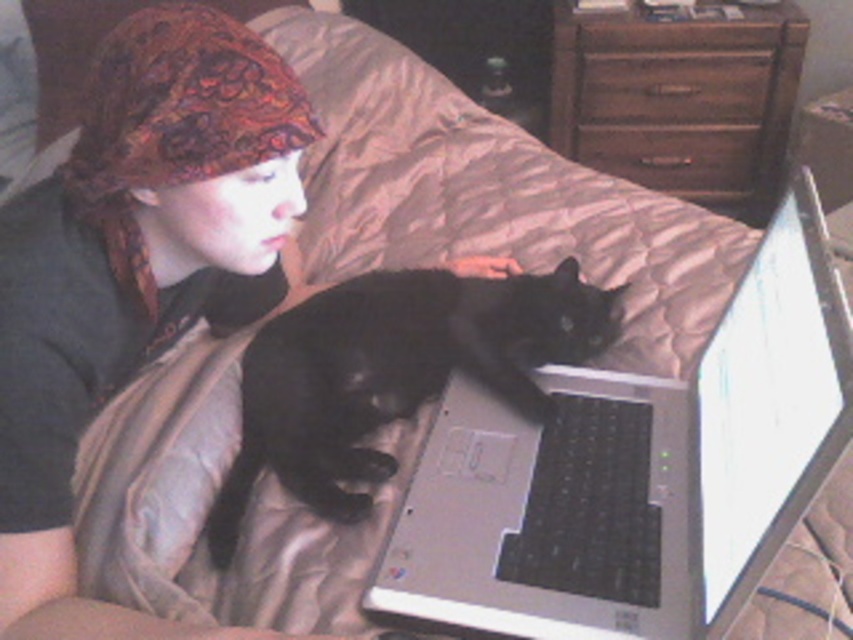
Question: Considering the real-world distances, which object is closest to the black fur cat at center?

Choices:
 (A) brown wood drawer at center
 (B) silver/black plastic laptop at center

Answer: (B)

Question: Observing the image, what is the correct spatial positioning of brown wood drawer at upper right in reference to brown wood drawer at center?

Choices:
 (A) above
 (B) below

Answer: (A)

Question: Does black fur cat at center have a greater width compared to brown wood drawer at upper right?

Choices:
 (A) no
 (B) yes

Answer: (A)

Question: Does black fur cat at center have a smaller size compared to brown wood dresser at upper right?

Choices:
 (A) yes
 (B) no

Answer: (A)

Question: Which point is farther from the camera taking this photo?

Choices:
 (A) (662, 141)
 (B) (624, 58)
 (C) (602, 499)

Answer: (A)

Question: Which point is closer to the camera taking this photo?

Choices:
 (A) (646, 77)
 (B) (679, 83)
 (C) (381, 292)
 (D) (575, 413)

Answer: (D)